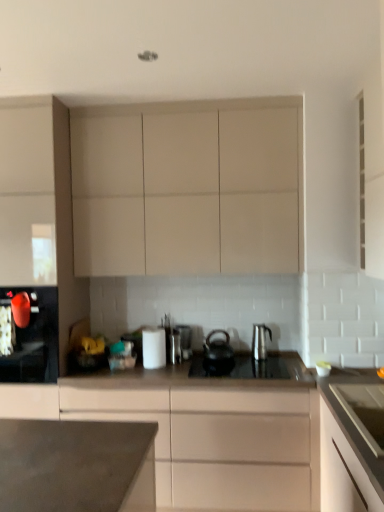
The height and width of the screenshot is (512, 384). What do you see at coordinates (41, 201) in the screenshot?
I see `matte white cabinet at left, the 1th cabinetry from the left` at bounding box center [41, 201].

Locate an element on the screen. Image resolution: width=384 pixels, height=512 pixels. black glass gas stove at center is located at coordinates tap(250, 367).

Where is `satin silver kettle at center, the 3th kitchen appliance in the left-to-right sequence`? This screenshot has width=384, height=512. satin silver kettle at center, the 3th kitchen appliance in the left-to-right sequence is located at coordinates (260, 341).

Image resolution: width=384 pixels, height=512 pixels. What do you see at coordinates (185, 340) in the screenshot? I see `satin silver toaster at center` at bounding box center [185, 340].

Image resolution: width=384 pixels, height=512 pixels. Describe the element at coordinates (188, 188) in the screenshot. I see `matte beige cabinet at upper center, marked as the second cabinetry in a left-to-right arrangement` at that location.

Identify the location of matte beige cabinet at center, placed as the 3th cabinetry when sorted from left to right. This screenshot has width=384, height=512. (206, 429).

Does matte beige cabinet at upper center, placed as the 3th cabinetry when sorted from right to left, appear on the left side of satin silver kettle at center, marked as the 1th kitchen appliance in a right-to-left arrangement?

Yes.

Is matte beige cabinet at upper center, marked as the second cabinetry in a left-to-right arrangement, inside the boundaries of satin silver kettle at center, the 3th kitchen appliance in the left-to-right sequence, or outside?

matte beige cabinet at upper center, marked as the second cabinetry in a left-to-right arrangement, is not enclosed by satin silver kettle at center, the 3th kitchen appliance in the left-to-right sequence.

Is matte beige cabinet at upper center, marked as the second cabinetry in a left-to-right arrangement, positioned with its back to satin silver kettle at center, marked as the 1th kitchen appliance in a right-to-left arrangement?

matte beige cabinet at upper center, marked as the second cabinetry in a left-to-right arrangement, does not have its back to satin silver kettle at center, marked as the 1th kitchen appliance in a right-to-left arrangement.

Is point (110, 119) closer or farther from the camera than point (259, 334)?

Point (110, 119).

Considering the relative sizes of matte beige cabinet at center, which is the second cabinetry from right to left, and satin silver toaster at center in the image provided, is matte beige cabinet at center, which is the second cabinetry from right to left, taller than satin silver toaster at center?

Correct, matte beige cabinet at center, which is the second cabinetry from right to left, is much taller as satin silver toaster at center.

Where is `appliance that is on the left side of matte beige cabinet at center, which is the second cabinetry from right to left`? This screenshot has height=512, width=384. appliance that is on the left side of matte beige cabinet at center, which is the second cabinetry from right to left is located at coordinates (185, 340).

Based on their positions, is matte beige cabinet at center, which is the second cabinetry from right to left, located to the left or right of satin silver toaster at center?

matte beige cabinet at center, which is the second cabinetry from right to left, is to the right of satin silver toaster at center.

Measure the distance from matte beige cabinet at center, placed as the 3th cabinetry when sorted from left to right, to satin silver toaster at center.

matte beige cabinet at center, placed as the 3th cabinetry when sorted from left to right, is 67.17 centimeters from satin silver toaster at center.

Is white glossy paper towel at center, which is counted as the second kitchen appliance, starting from the right, with white matte cabinet at right, placed as the fourth cabinetry when sorted from left to right?

No.

Considering the relative positions of white glossy paper towel at center, which is counted as the second kitchen appliance, starting from the right, and white matte cabinet at right, arranged as the 1th cabinetry when viewed from the right, in the image provided, is white glossy paper towel at center, which is counted as the second kitchen appliance, starting from the right, in front of white matte cabinet at right, arranged as the 1th cabinetry when viewed from the right,?

No, it is behind white matte cabinet at right, arranged as the 1th cabinetry when viewed from the right.

Image resolution: width=384 pixels, height=512 pixels. What are the coordinates of `the 1st kitchen appliance above the white matte cabinet at right, arranged as the 1th cabinetry when viewed from the right (from the image's perspective)` in the screenshot? It's located at (154, 348).

In the scene shown: Can we say white glossy paper towel at center, which is counted as the second kitchen appliance, starting from the right, lies outside white matte cabinet at right, placed as the fourth cabinetry when sorted from left to right?

Yes.

From the picture: Can you confirm if matte black kettle at left, the 3th kitchen appliance from the right, is taller than white glossy paper towel at center, which is the second kitchen appliance from left to right?

Correct, matte black kettle at left, the 3th kitchen appliance from the right, is much taller as white glossy paper towel at center, which is the second kitchen appliance from left to right.

Would you consider matte black kettle at left, the 3th kitchen appliance from the right, to be distant from white glossy paper towel at center, which is the second kitchen appliance from left to right?

Actually, matte black kettle at left, the 3th kitchen appliance from the right, and white glossy paper towel at center, which is the second kitchen appliance from left to right, are a little close together.

Considering the sizes of matte black kettle at left, the 3th kitchen appliance from the right, and white glossy paper towel at center, which is the second kitchen appliance from left to right, in the image, is matte black kettle at left, the 3th kitchen appliance from the right, wider or thinner than white glossy paper towel at center, which is the second kitchen appliance from left to right,?

matte black kettle at left, the 3th kitchen appliance from the right, is wider than white glossy paper towel at center, which is the second kitchen appliance from left to right.

How much distance is there between matte black kettle at left, marked as the first kitchen appliance in a left-to-right arrangement, and white glossy paper towel at center, which is the second kitchen appliance from left to right?

26.22 inches.

Are matte beige cabinet at center, which is the second cabinetry from right to left, and matte white cabinet at left, the 1th cabinetry from the left, located far from each other?

Indeed, matte beige cabinet at center, which is the second cabinetry from right to left, is not near matte white cabinet at left, the 1th cabinetry from the left.

Looking at this image, is matte beige cabinet at center, which is the second cabinetry from right to left, smaller than matte white cabinet at left, the 1th cabinetry from the left?

No.

From a real-world perspective, relative to matte white cabinet at left, the 1th cabinetry from the left, is matte beige cabinet at center, placed as the 3th cabinetry when sorted from left to right, vertically above or below?

Clearly, from a real-world perspective, matte beige cabinet at center, placed as the 3th cabinetry when sorted from left to right, is below matte white cabinet at left, the 1th cabinetry from the left.

Considering the relative sizes of matte black kettle at left, marked as the first kitchen appliance in a left-to-right arrangement, and black matte tea pot at center in the image provided, is matte black kettle at left, marked as the first kitchen appliance in a left-to-right arrangement, shorter than black matte tea pot at center?

Incorrect, the height of matte black kettle at left, marked as the first kitchen appliance in a left-to-right arrangement, does not fall short of that of black matte tea pot at center.

Which is behind, matte black kettle at left, marked as the first kitchen appliance in a left-to-right arrangement, or black matte tea pot at center?

black matte tea pot at center.

Does matte black kettle at left, marked as the first kitchen appliance in a left-to-right arrangement, have a lesser width compared to black matte tea pot at center?

No.

Is matte beige cabinet at center, which is the second cabinetry from right to left, next to white matte cabinet at right, arranged as the 1th cabinetry when viewed from the right?

They are not placed beside each other.

At what (x,y) coordinates should I click in order to perform the action: click on cabinetry on the right of matte beige cabinet at center, which is the second cabinetry from right to left. Please return your answer as a coordinate pair (x, y). Looking at the image, I should click on (342, 471).

Could you tell me if matte beige cabinet at center, which is the second cabinetry from right to left, is turned towards white matte cabinet at right, placed as the fourth cabinetry when sorted from left to right?

No, matte beige cabinet at center, which is the second cabinetry from right to left, is not turned towards white matte cabinet at right, placed as the fourth cabinetry when sorted from left to right.

Which object is closer to the camera, matte beige cabinet at center, which is the second cabinetry from right to left, or white matte cabinet at right, arranged as the 1th cabinetry when viewed from the right?

Positioned in front is matte beige cabinet at center, which is the second cabinetry from right to left.

Find the location of `the 1st cabinetry in front of the satin silver kettle at center, marked as the 1th kitchen appliance in a right-to-left arrangement`. the 1st cabinetry in front of the satin silver kettle at center, marked as the 1th kitchen appliance in a right-to-left arrangement is located at coordinates (188, 188).

Identify the location of appliance on the left of the matte beige cabinet at center, which is the second cabinetry from right to left. (185, 340).

From the image, which object appears to be nearer to matte black kettle at left, the 3th kitchen appliance from the right, satin silver kettle at center, marked as the 1th kitchen appliance in a right-to-left arrangement, or black glass gas stove at center?

The object closer to matte black kettle at left, the 3th kitchen appliance from the right, is black glass gas stove at center.

Which object lies further to the anchor point satin silver toaster at center, satin silver kettle at center, the 3th kitchen appliance in the left-to-right sequence, or matte black kettle at left, marked as the first kitchen appliance in a left-to-right arrangement?

matte black kettle at left, marked as the first kitchen appliance in a left-to-right arrangement, lies further to satin silver toaster at center than the other object.

Looking at this image, looking at the image, which one is located closer to satin silver toaster at center, satin silver kettle at center, the 3th kitchen appliance in the left-to-right sequence, or white glossy paper towel at center, which is counted as the second kitchen appliance, starting from the right?

Based on the image, white glossy paper towel at center, which is counted as the second kitchen appliance, starting from the right, appears to be nearer to satin silver toaster at center.

From the picture: Looking at the image, which one is located closer to white matte cabinet at right, placed as the fourth cabinetry when sorted from left to right, white glossy paper towel at center, which is counted as the second kitchen appliance, starting from the right, or black matte tea pot at center?

black matte tea pot at center is positioned closer to the anchor white matte cabinet at right, placed as the fourth cabinetry when sorted from left to right.

Estimate the real-world distances between objects in this image. Which object is closer to satin silver kettle at center, marked as the 1th kitchen appliance in a right-to-left arrangement, matte black kettle at left, the 3th kitchen appliance from the right, or black glass gas stove at center?

The object closer to satin silver kettle at center, marked as the 1th kitchen appliance in a right-to-left arrangement, is black glass gas stove at center.

Based on their spatial positions, is matte black kettle at left, marked as the first kitchen appliance in a left-to-right arrangement, or black matte tea pot at center further from satin silver toaster at center?

matte black kettle at left, marked as the first kitchen appliance in a left-to-right arrangement, is positioned further to the anchor satin silver toaster at center.

Which object lies further to the anchor point satin silver toaster at center, matte beige cabinet at center, which is the second cabinetry from right to left, or satin silver kettle at center, marked as the 1th kitchen appliance in a right-to-left arrangement?

Based on the image, matte beige cabinet at center, which is the second cabinetry from right to left, appears to be further to satin silver toaster at center.

Which object lies further to the anchor point matte beige cabinet at upper center, placed as the 3th cabinetry when sorted from right to left, satin silver toaster at center or satin silver kettle at center, marked as the 1th kitchen appliance in a right-to-left arrangement?

satin silver kettle at center, marked as the 1th kitchen appliance in a right-to-left arrangement, lies further to matte beige cabinet at upper center, placed as the 3th cabinetry when sorted from right to left, than the other object.

Identify the location of tea pot between matte black kettle at left, the 3th kitchen appliance from the right, and satin silver kettle at center, marked as the 1th kitchen appliance in a right-to-left arrangement, in the horizontal direction. The width and height of the screenshot is (384, 512). (218, 350).

Image resolution: width=384 pixels, height=512 pixels. In order to click on gas stove situated between matte black kettle at left, the 3th kitchen appliance from the right, and white matte cabinet at right, arranged as the 1th cabinetry when viewed from the right, from left to right in this screenshot , I will do `click(250, 367)`.

Find the location of a particular element. tea pot located between black glass gas stove at center and satin silver toaster at center in the depth direction is located at coordinates (218, 350).

You are a GUI agent. You are given a task and a screenshot of the screen. Output one action in this format:
    pyautogui.click(x=<x>, y=<y>)
    Task: Click on the gas stove situated between matte white cabinet at left, the 1th cabinetry from the left, and satin silver kettle at center, the 3th kitchen appliance in the left-to-right sequence, from left to right
    Image resolution: width=384 pixels, height=512 pixels.
    Given the screenshot: What is the action you would take?
    pyautogui.click(x=250, y=367)